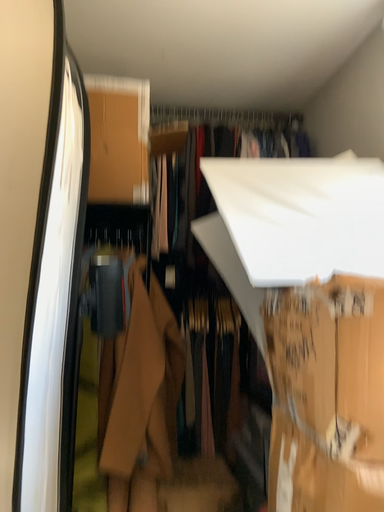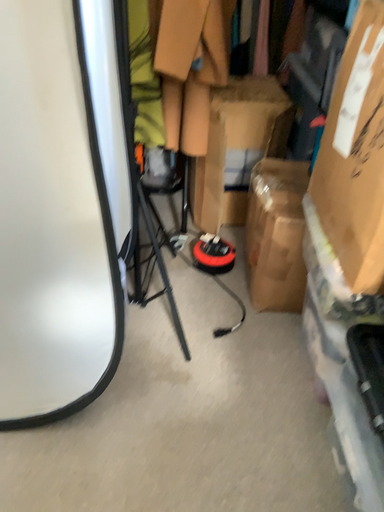
Question: How did the camera likely rotate when shooting the video?

Choices:
 (A) rotated downward
 (B) rotated upward

Answer: (A)